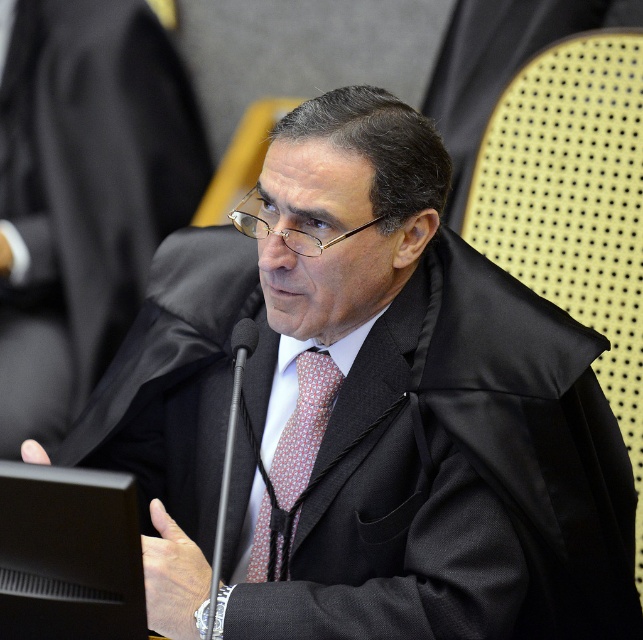
You are a photographer adjusting your camera to focus on two points in the scene. The first point is at coordinates point [87,113] and the second point is at point [242,339]. Which point should you focus on first if you want to capture the closest object to the camera?

Point [87,113] is further to the camera than point [242,339], so you should focus on point [87,113] first as it is closer to the camera.

You are designing a presentation slide and need to know which object is wider between the red dotted tie at center and the black plastic microphone at center in the image. Based on the scene, can you determine which one is wider?

The red dotted tie at center is wider than the black plastic microphone at center.